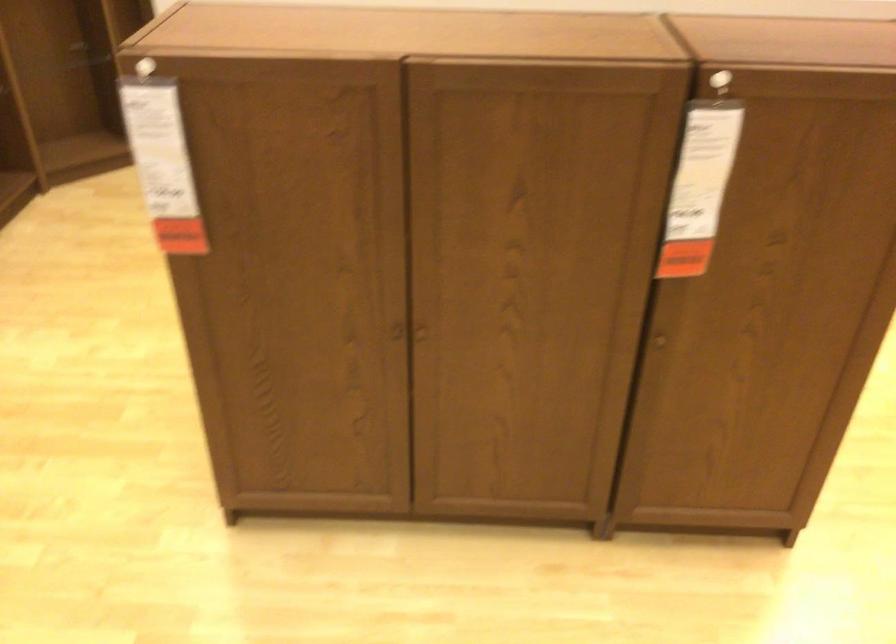
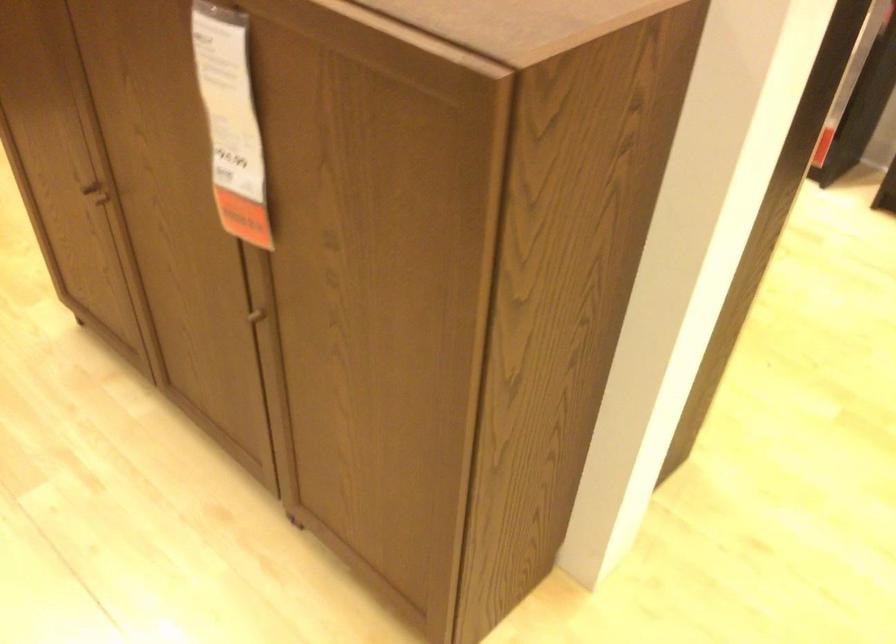
The point at (x=685, y=183) is marked in the first image. Where is the corresponding point in the second image?

(230, 122)